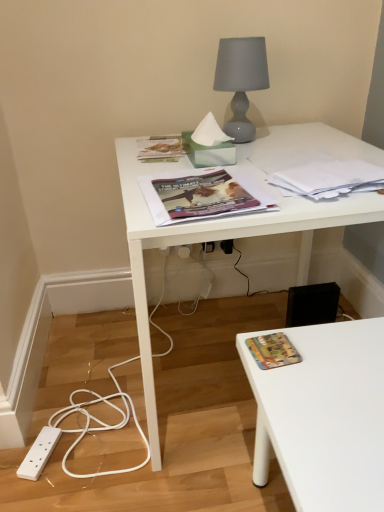
At what (x,y) coordinates should I click in order to perform the action: click on vacant space to the right of matte gray glass lamp at upper center. Please return your answer as a coordinate pair (x, y). The height and width of the screenshot is (512, 384). Looking at the image, I should click on (298, 134).